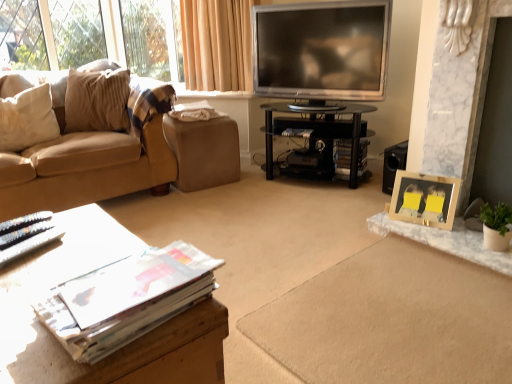
Question: In the image, is beige corduroy couch at left positioned in front of or behind wooden table at lower left, the 1th table from the left?

Choices:
 (A) behind
 (B) front

Answer: (A)

Question: From the image's perspective, is beige corduroy couch at left located above or below wooden table at lower left, which is the 1th table from front to back?

Choices:
 (A) above
 (B) below

Answer: (A)

Question: Estimate the real-world distances between objects in this image. Which object is closer to the beige corduroy couch at left?

Choices:
 (A) matte paper magazine at center, which is the second magazine from left to right
 (B) white soft pillow at left
 (C) black glass tv stand at center, which is the first table in right-to-left order
 (D) white glossy magazine at lower left, the 1th magazine positioned from the front
 (E) wooden table at lower left, which appears as the 1th table when ordered from the bottom

Answer: (B)

Question: Based on their relative distances, which object is nearer to the beige corduroy couch at left?

Choices:
 (A) black glass tv stand at center, the second table from the bottom
 (B) matte paper magazine at center, positioned as the 1th magazine in top-to-bottom order
 (C) white soft pillow at left
 (D) brown leather footrest at center
 (E) matte paper magazine at center, which appears as the 2th magazine when viewed from the top

Answer: (C)